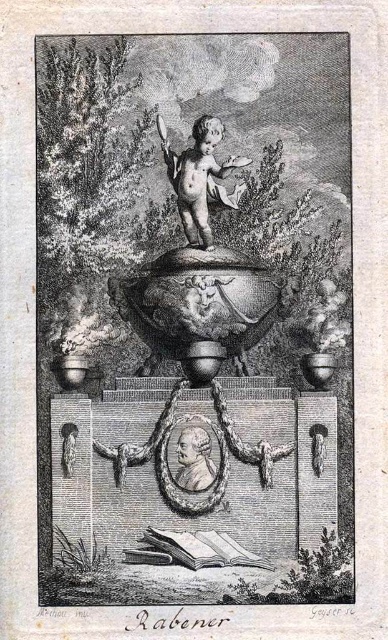
You are an art conservator examining the engraving and need to determine the spatial relationship between two points marked in the scene. Which point is closer to you, point (164, 61) or point (197, 132)?

Point (164, 61) is further to the viewer than point (197, 132), so point (197, 132) is closer to you.

You are an art conservator examining the engraving. You need to determine the placement of the etched bronze urn at center and the smooth bronze cherub at center for restoration. Based on the engraving, which object is positioned closer to the viewer?

The etched bronze urn at center is positioned closer to the viewer than the smooth bronze cherub at center, as it is in front of it according to the engraving.